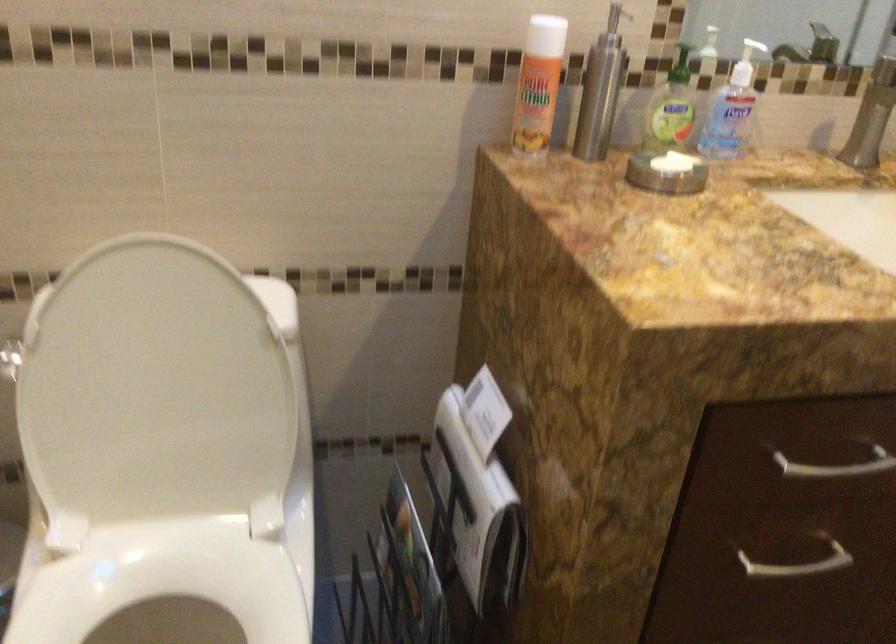
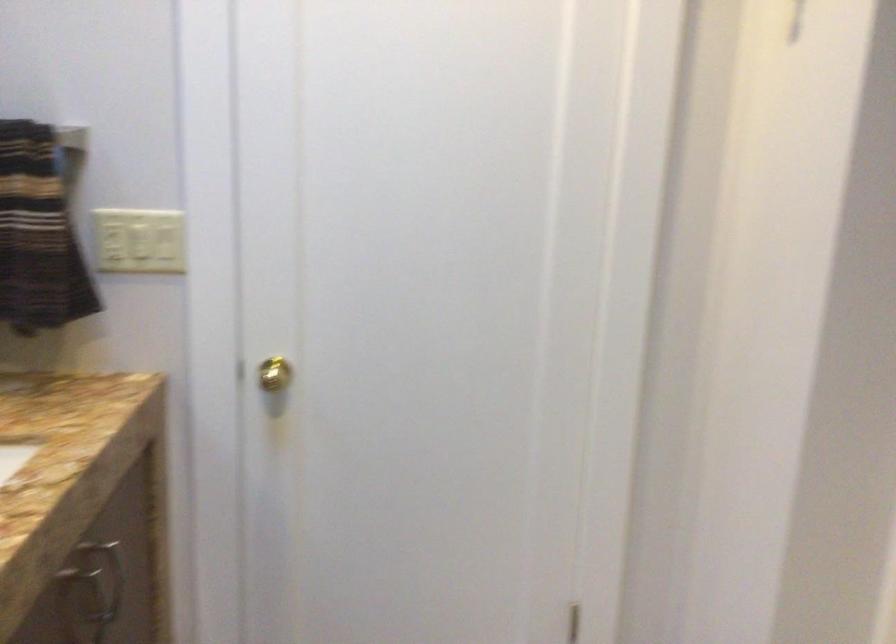
Question: The camera is either moving clockwise (left) or counter-clockwise (right) around the object. The first image is from the beginning of the video and the second image is from the end. Is the camera moving left or right when shooting the video?

Choices:
 (A) Left
 (B) Right

Answer: (A)